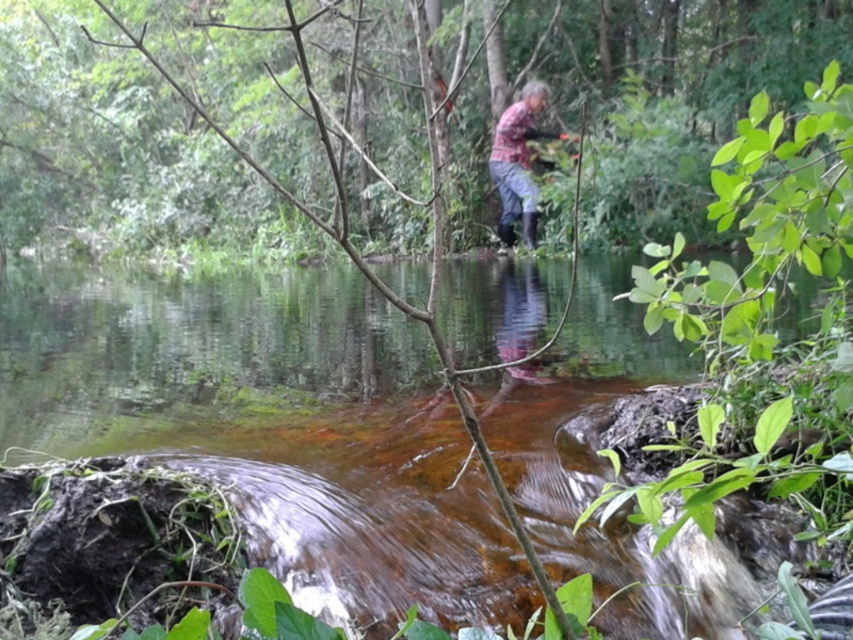
Question: Among these points, which one is nearest to the camera?

Choices:
 (A) (332, 474)
 (B) (527, 129)

Answer: (A)

Question: Considering the relative positions of brown muddy water at center and plaid fabric shirt at center in the image provided, where is brown muddy water at center located with respect to plaid fabric shirt at center?

Choices:
 (A) right
 (B) left

Answer: (B)

Question: Is brown muddy water at center smaller than plaid fabric shirt at center?

Choices:
 (A) no
 (B) yes

Answer: (A)

Question: In this image, where is brown muddy water at center located relative to plaid fabric shirt at center?

Choices:
 (A) right
 (B) left

Answer: (B)